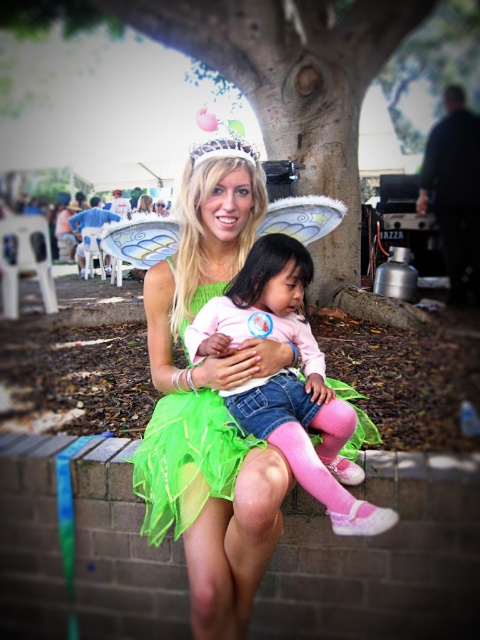
Question: Where is green tulle dress at center located in relation to green leafy tree at center in the image?

Choices:
 (A) right
 (B) left

Answer: (B)

Question: Which object is positioned closest to the pink fabric dress at center?

Choices:
 (A) green tulle dress at center
 (B) green leafy tree at center

Answer: (A)

Question: Is green leafy tree at center above pink fabric dress at center?

Choices:
 (A) no
 (B) yes

Answer: (B)

Question: Among these objects, which one is nearest to the camera?

Choices:
 (A) green leafy tree at center
 (B) pink fabric dress at center

Answer: (B)

Question: Which point is farther from the camera taking this photo?

Choices:
 (A) (336, 60)
 (B) (289, 268)
 (C) (194, 193)

Answer: (A)

Question: Is green leafy tree at center further to camera compared to pink fabric dress at center?

Choices:
 (A) yes
 (B) no

Answer: (A)